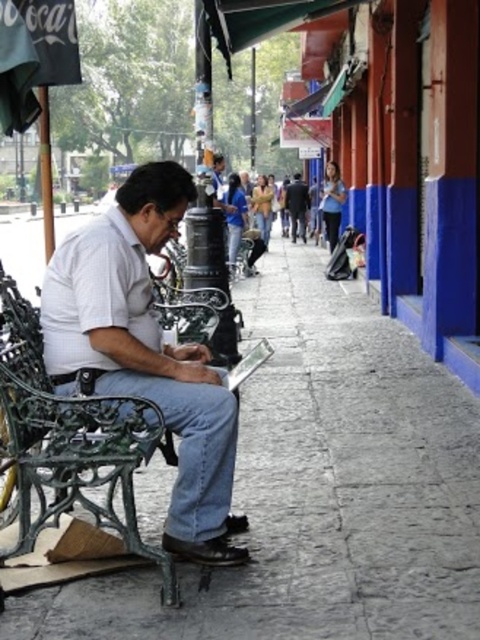
What is the 2D coordinate of the gray stone pavement at lower center in the image?

The gray stone pavement at lower center is located at the 2D coordinate point of (320, 488).

You are standing at the point marked by the coordinate point (320, 488). What is the surface you are standing on?

The surface you are standing on is the gray stone pavement at lower center, which is represented by the point (320, 488).

In the scene shown: You are a delivery person who needs to place a small package on the ground near the white cotton shirt at center. Given the gray stone pavement at lower center, can you determine if there is enough space to place the package without it overlapping the shirt?

The gray stone pavement at lower center is larger in size than the white cotton shirt at center, so there is sufficient space to place the package on the gray stone pavement at lower center without overlapping the shirt.